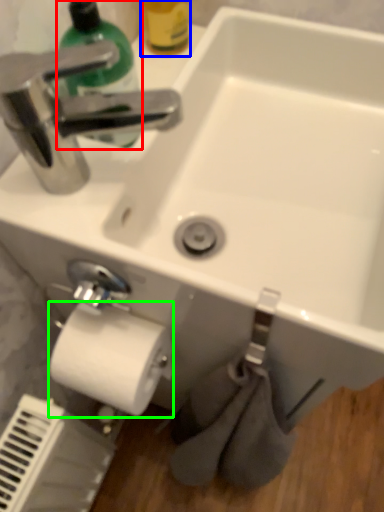
Question: Which is nearer to the cleaning product (highlighted by a red box)? bottle (highlighted by a blue box) or toilet paper (highlighted by a green box).

Choices:
 (A) bottle
 (B) toilet paper

Answer: (A)